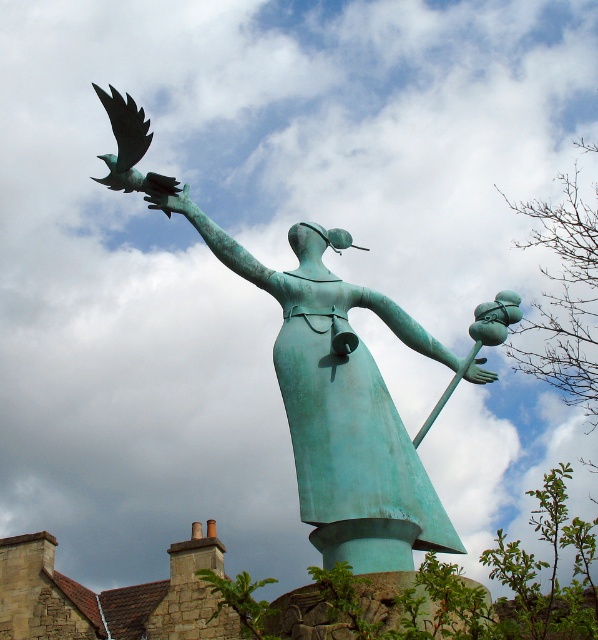
Who is positioned more to the right, green patina statue at center or green patina bird at upper left?

Positioned to the right is green patina statue at center.

Can you confirm if green patina statue at center is wider than green patina bird at upper left?

In fact, green patina statue at center might be narrower than green patina bird at upper left.

Does point (321, 276) come behind point (126, 109)?

No, it is in front of (126, 109).

At what (x,y) coordinates should I click in order to perform the action: click on green patina statue at center. Please return your answer as a coordinate pair (x, y). The image size is (598, 640). Looking at the image, I should click on (340, 406).